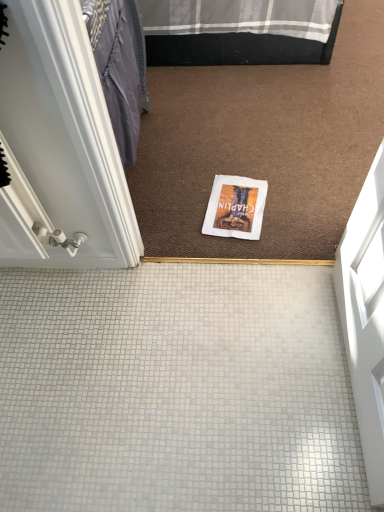
Describe the element at coordinates (59, 147) in the screenshot. I see `white glossy door at left` at that location.

The height and width of the screenshot is (512, 384). I want to click on white paper magazine at center, so click(235, 207).

Where is `white tile floor at center`? This screenshot has height=512, width=384. white tile floor at center is located at coordinates (176, 390).

Describe the element at coordinates (176, 390) in the screenshot. The image size is (384, 512). I see `white tile floor at center` at that location.

You are a GUI agent. You are given a task and a screenshot of the screen. Output one action in this format:
    pyautogui.click(x=<x>, y=<y>)
    Task: Click on the white glossy door at left
    The width and height of the screenshot is (384, 512).
    Given the screenshot: What is the action you would take?
    pyautogui.click(x=59, y=147)

Is point (18, 325) less distant than point (261, 187)?

Yes, point (18, 325) is closer to viewer.

Is white tile floor at center oriented towards white paper magazine at center?

Yes.

Looking at this image, which of these two, white tile floor at center or white paper magazine at center, stands shorter?

Standing shorter between the two is white paper magazine at center.

Looking at this image, is white tile floor at center inside the boundaries of white paper magazine at center, or outside?

white tile floor at center cannot be found inside white paper magazine at center.

Considering the sizes of objects white paper magazine at center and white glossy door at left in the image provided, who is smaller, white paper magazine at center or white glossy door at left?

white paper magazine at center.

Is white paper magazine at center not inside white glossy door at left?

Yes, white paper magazine at center is outside of white glossy door at left.

Which object is wider, white paper magazine at center or white glossy door at left?

With larger width is white glossy door at left.

From the image's perspective, which one is positioned lower, white paper magazine at center or white glossy door at left?

white paper magazine at center appears lower in the image.

Considering the sizes of white glossy door at left and white tile floor at center in the image, is white glossy door at left wider or thinner than white tile floor at center?

Clearly, white glossy door at left has less width compared to white tile floor at center.

In the scene shown: Who is taller, white glossy door at left or white tile floor at center?

white glossy door at left is taller.

Considering the relative sizes of white glossy door at left and white tile floor at center in the image provided, is white glossy door at left smaller than white tile floor at center?

No, white glossy door at left is not smaller than white tile floor at center.

Based on the photo, measure the distance from white glossy door at left to white tile floor at center.

white glossy door at left and white tile floor at center are 19.09 inches apart from each other.

Is white tile floor at center oriented towards white glossy door at left?

No, white tile floor at center does not turn towards white glossy door at left.

Is white tile floor at center to the right of white glossy door at left from the viewer's perspective?

Yes, white tile floor at center is to the right of white glossy door at left.

Which of these two, white tile floor at center or white glossy door at left, is smaller?

Smaller between the two is white tile floor at center.

Looking at their sizes, would you say white tile floor at center is wider or thinner than white glossy door at left?

In the image, white tile floor at center appears to be wider than white glossy door at left.

Looking at the image, does white glossy door at left seem bigger or smaller compared to white paper magazine at center?

In the image, white glossy door at left appears to be larger than white paper magazine at center.

Is white glossy door at left positioned far away from white paper magazine at center?

No, white glossy door at left is in close proximity to white paper magazine at center.

From the image's perspective, which object appears higher, white glossy door at left or white paper magazine at center?

From the image's view, white glossy door at left is above.

How distant is white glossy door at left from white paper magazine at center?

A distance of 20.63 inches exists between white glossy door at left and white paper magazine at center.

Considering the sizes of objects white paper magazine at center and white tile floor at center in the image provided, who is bigger, white paper magazine at center or white tile floor at center?

white tile floor at center is bigger.

Are white paper magazine at center and white tile floor at center far apart?

No.

From the image's perspective, is white paper magazine at center above white tile floor at center?

Indeed, from the image's perspective, white paper magazine at center is shown above white tile floor at center.

From a real-world perspective, which is physically below, white paper magazine at center or white tile floor at center?

white tile floor at center is physically lower.

Where is `magazine behind the white tile floor at center`? The image size is (384, 512). magazine behind the white tile floor at center is located at coordinates (235, 207).

At what (x,y) coordinates should I click in order to perform the action: click on door above the white paper magazine at center (from a real-world perspective). Please return your answer as a coordinate pair (x, y). Looking at the image, I should click on (59, 147).

Which object lies further to the anchor point white paper magazine at center, white glossy door at left or white tile floor at center?

Among the two, white glossy door at left is located further to white paper magazine at center.

Considering their positions, is white paper magazine at center positioned closer to white glossy door at left than white tile floor at center?

white tile floor at center.

Considering their positions, is white paper magazine at center positioned closer to white tile floor at center than white glossy door at left?

Among the two, white glossy door at left is located nearer to white tile floor at center.

Which object lies further to the anchor point white tile floor at center, white glossy door at left or white paper magazine at center?

The object further to white tile floor at center is white paper magazine at center.

Based on their spatial positions, is white tile floor at center or white glossy door at left closer to white paper magazine at center?

Among the two, white tile floor at center is located nearer to white paper magazine at center.

Looking at this image, which object lies further to the anchor point white glossy door at left, white tile floor at center or white paper magazine at center?

white paper magazine at center.

Where is `magazine that lies between white glossy door at left and white tile floor at center from top to bottom`? This screenshot has width=384, height=512. magazine that lies between white glossy door at left and white tile floor at center from top to bottom is located at coordinates (235, 207).